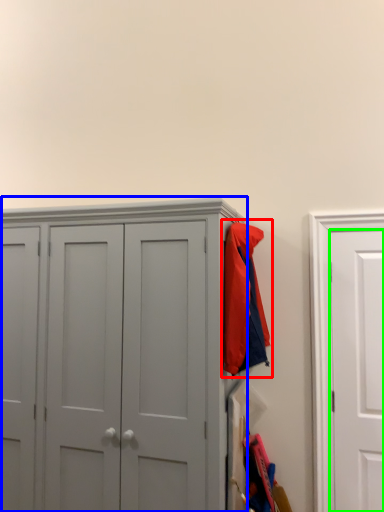
Question: Based on their relative distances, which object is nearer to jacket (highlighted by a red box)? Choose from cupboard (highlighted by a blue box) and door (highlighted by a green box).

Choices:
 (A) cupboard
 (B) door

Answer: (A)